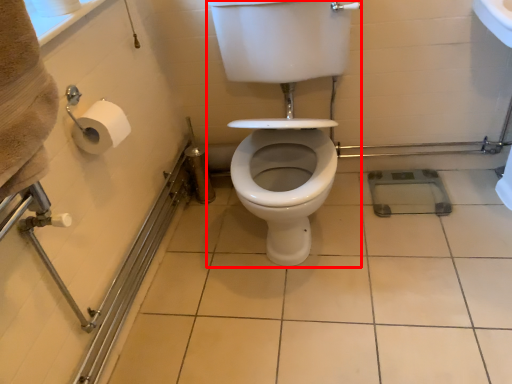
Question: In this image, where is sit (annotated by the red box) located relative to ceramic tile?

Choices:
 (A) left
 (B) right

Answer: (A)